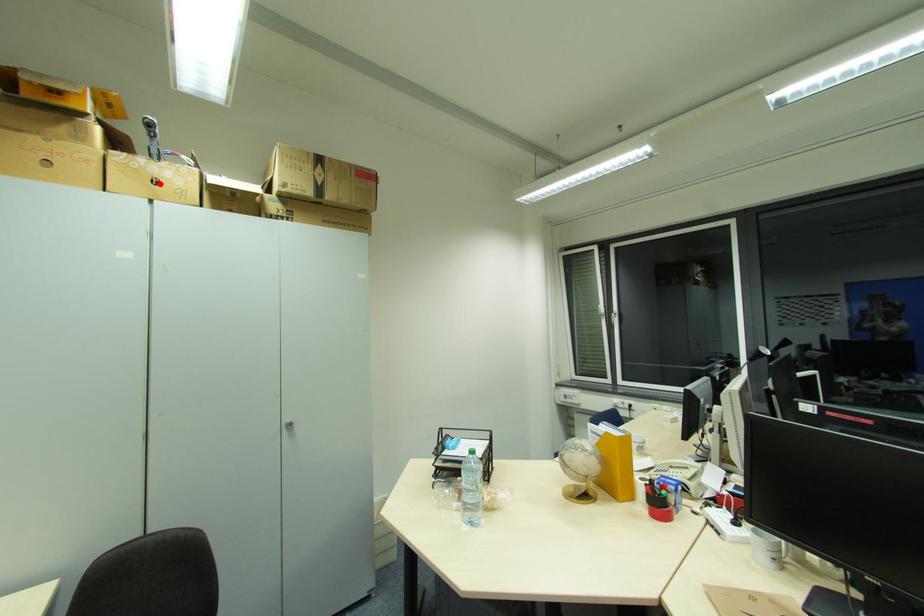
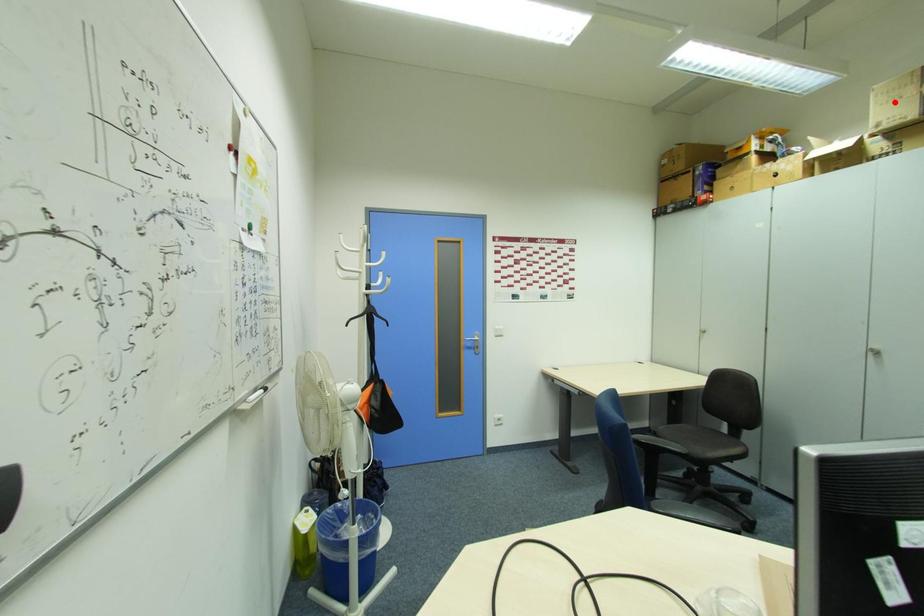
I am providing you with two images of the same scene from different viewpoints. A red point is marked on the first image and another point is marked on the second image. Does the point marked in image1 correspond to the same location as the one in image2?

No